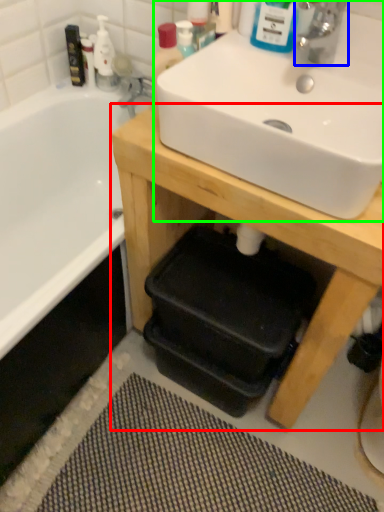
Question: Estimate the real-world distances between objects in this image. Which object is closer to table (highlighted by a red box), tap (highlighted by a blue box) or sink (highlighted by a green box)?

Choices:
 (A) tap
 (B) sink

Answer: (B)